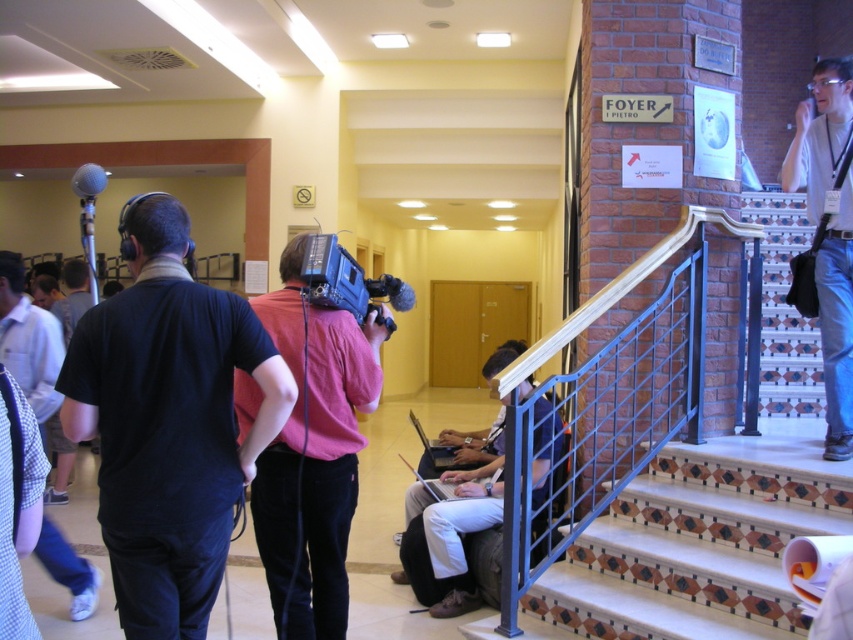
Between black matte shirt at left and matte black laptop at stairs, which one has more height?

matte black laptop at stairs

Image resolution: width=853 pixels, height=640 pixels. Find the location of `black matte shirt at left`. black matte shirt at left is located at coordinates (167, 420).

Is point (276, 408) farther from viewer compared to point (103, 173)?

No, (276, 408) is closer to viewer.

This screenshot has width=853, height=640. I want to click on black matte shirt at left, so coord(167,420).

Between point (166, 356) and point (83, 168), which one is positioned in front?

Point (166, 356)

Where is `black matte shirt at left`? The width and height of the screenshot is (853, 640). black matte shirt at left is located at coordinates (167, 420).

Who is more forward, (804, 320) or (88, 164)?

Point (88, 164) is more forward.

Is white tiled stairwell at right shorter than matte gray microphone at upper left?

No, white tiled stairwell at right is not shorter than matte gray microphone at upper left.

What do you see at coordinates (784, 310) in the screenshot?
I see `white tiled stairwell at right` at bounding box center [784, 310].

At what (x,y) coordinates should I click in order to perform the action: click on white tiled stairwell at right. Please return your answer as a coordinate pair (x, y). Image resolution: width=853 pixels, height=640 pixels. Looking at the image, I should click on (784, 310).